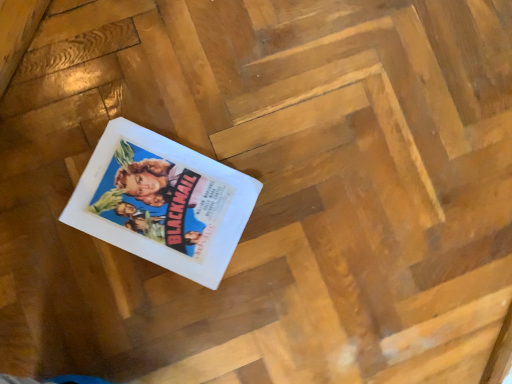
The height and width of the screenshot is (384, 512). What are the coordinates of `vacant area situated below white paper at center (from a real-world perspective)` in the screenshot? It's located at [x=162, y=207].